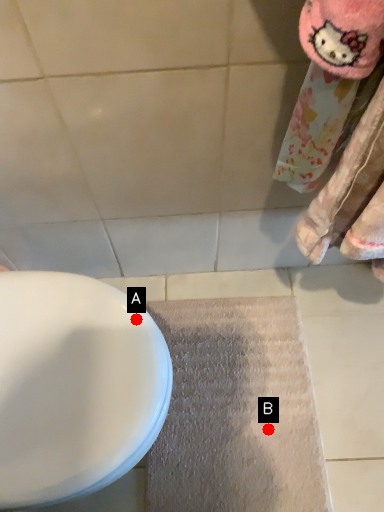
Question: Two points are circled on the image, labeled by A and B beside each circle. Which point is farther to the camera?

Choices:
 (A) A is further
 (B) B is further

Answer: (B)